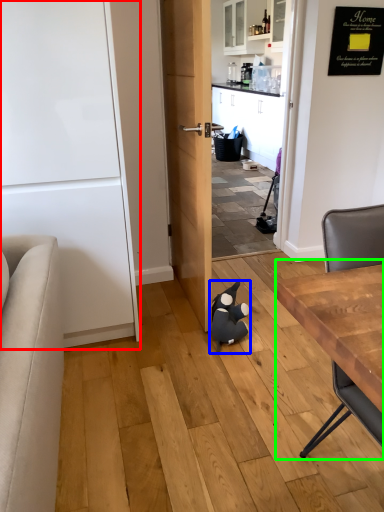
Question: Which object is positioned farthest from door (highlighted by a red box)? Select from animal (highlighted by a blue box) and table (highlighted by a green box).

Choices:
 (A) animal
 (B) table

Answer: (B)